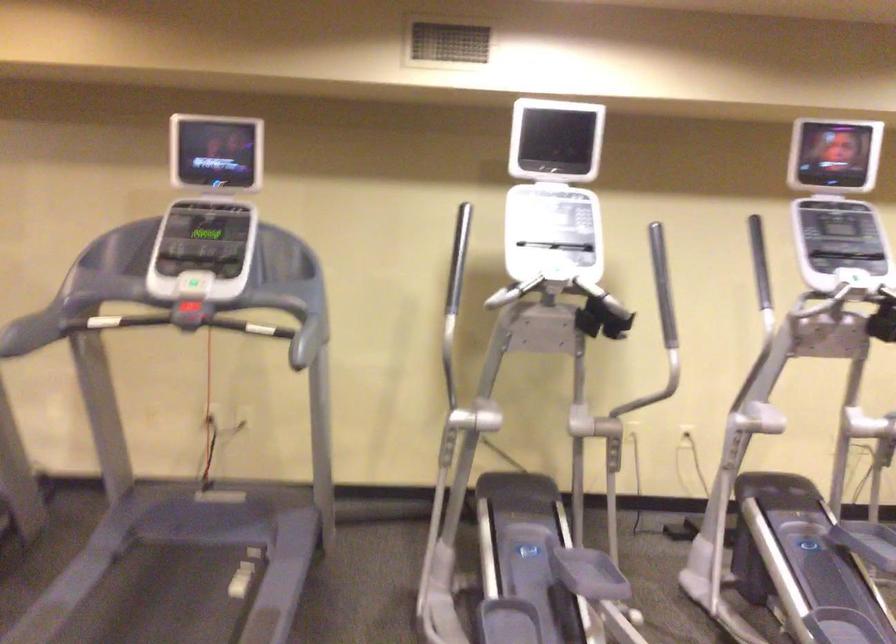
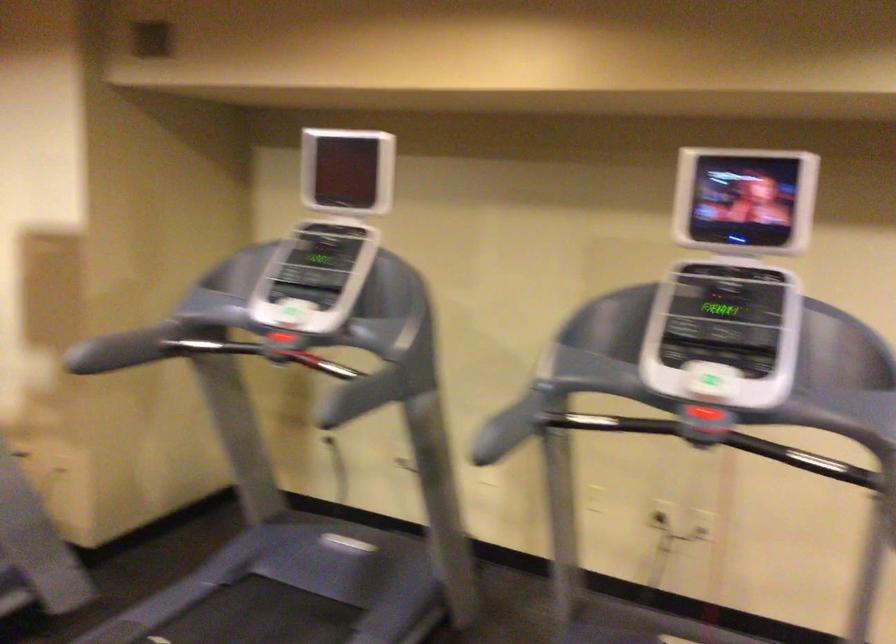
Question: The camera is either moving clockwise (left) or counter-clockwise (right) around the object. The first image is from the beginning of the video and the second image is from the end. Is the camera moving left or right when shooting the video?

Choices:
 (A) Left
 (B) Right

Answer: (B)